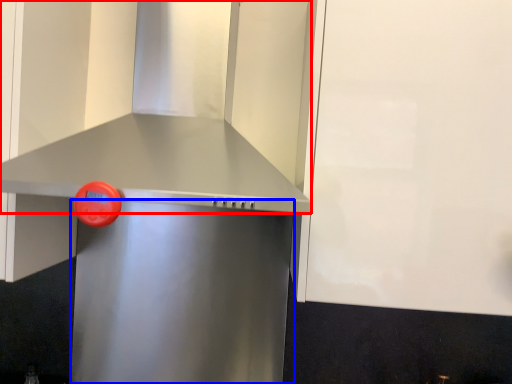
Question: Among these objects, which one is farthest to the camera, vent (highlighted by a red box) or appliance (highlighted by a blue box)?

Choices:
 (A) vent
 (B) appliance

Answer: (B)